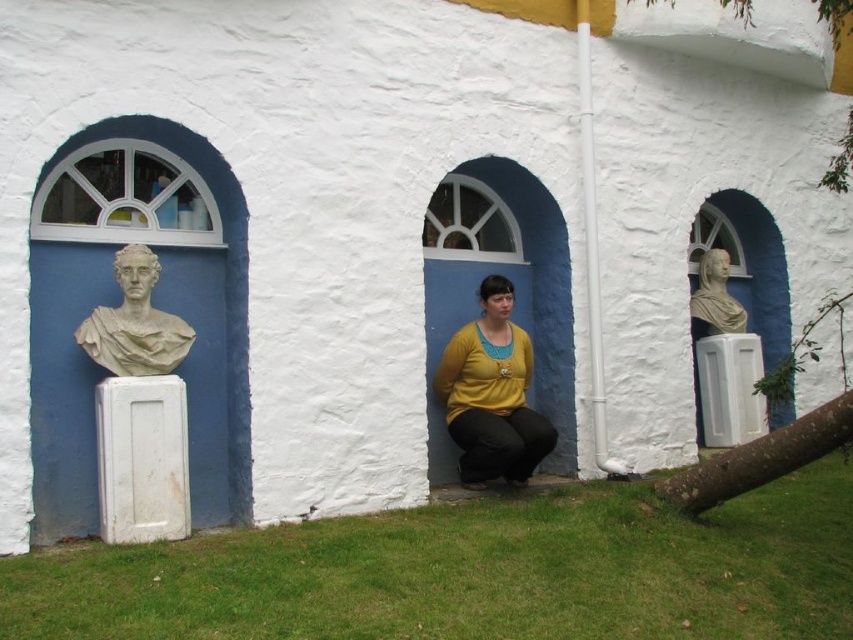
You are a painter standing at the base of the building, planning to paint the brown rough bark tree at lower right and the white marble bust at center right. You have a 2.5 meter long ladder. Can you reach both subjects without moving the ladder?

The brown rough bark tree at lower right and white marble bust at center right are 2.24 meters apart from each other. Since the ladder is 2.5 meters long, which is longer than the distance between them, you can position the ladder in between them and reach both subjects without moving it.

Based on the scene description, where is the white marble bust at left located in relation to the central doorway?

The white marble bust at left is located to the left side of the central doorway.